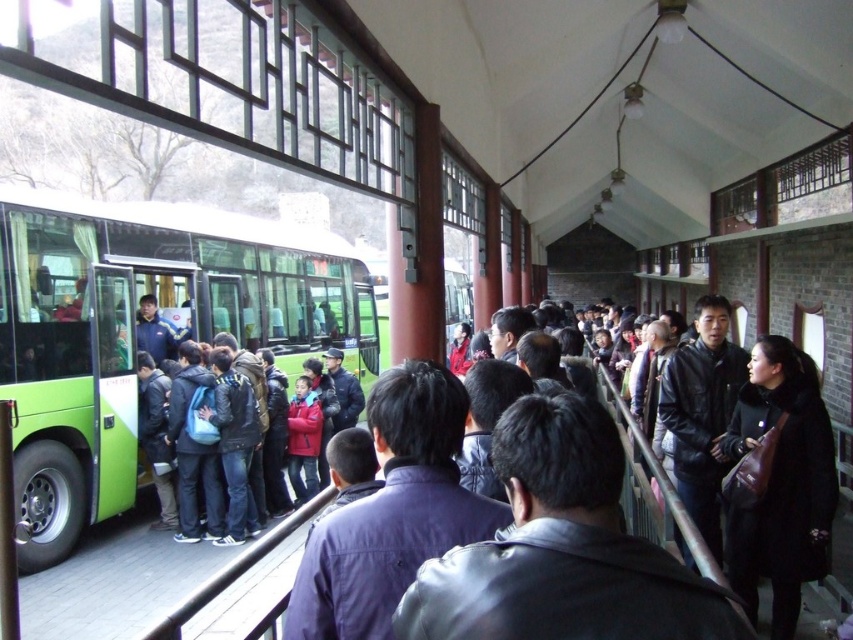
Question: Which point appears closest to the camera in this image?

Choices:
 (A) (134, 243)
 (B) (572, 440)

Answer: (B)

Question: Does green matte bus at left appear under dark blue leather jacket at center?

Choices:
 (A) yes
 (B) no

Answer: (B)

Question: Is green matte bus at left thinner than dark blue leather jacket at center?

Choices:
 (A) yes
 (B) no

Answer: (B)

Question: Can you confirm if green matte bus at left is positioned to the left of dark blue leather jacket at center?

Choices:
 (A) no
 (B) yes

Answer: (B)